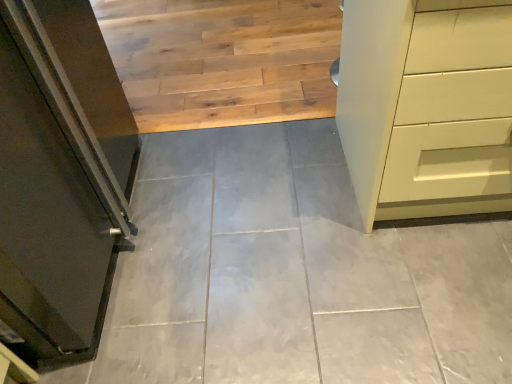
The width and height of the screenshot is (512, 384). Describe the element at coordinates (426, 106) in the screenshot. I see `matte yellow chest of drawers at right` at that location.

In order to face matte yellow chest of drawers at right, should I rotate leftwards or rightwards?

To face it directly, rotate right by 27.621 degrees.

Locate an element on the screen. The image size is (512, 384). matte yellow chest of drawers at right is located at coordinates (426, 106).

What are the coordinates of `matte yellow chest of drawers at right` in the screenshot? It's located at (426, 106).